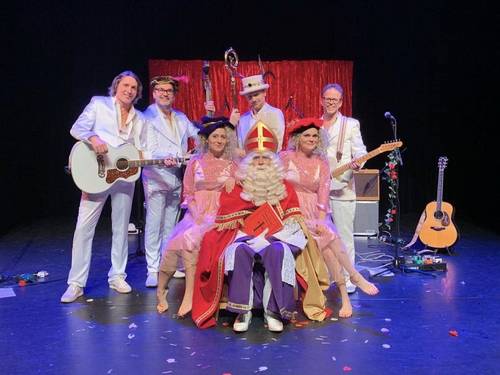
In order to click on mic stand in this screenshot , I will do `click(398, 263)`.